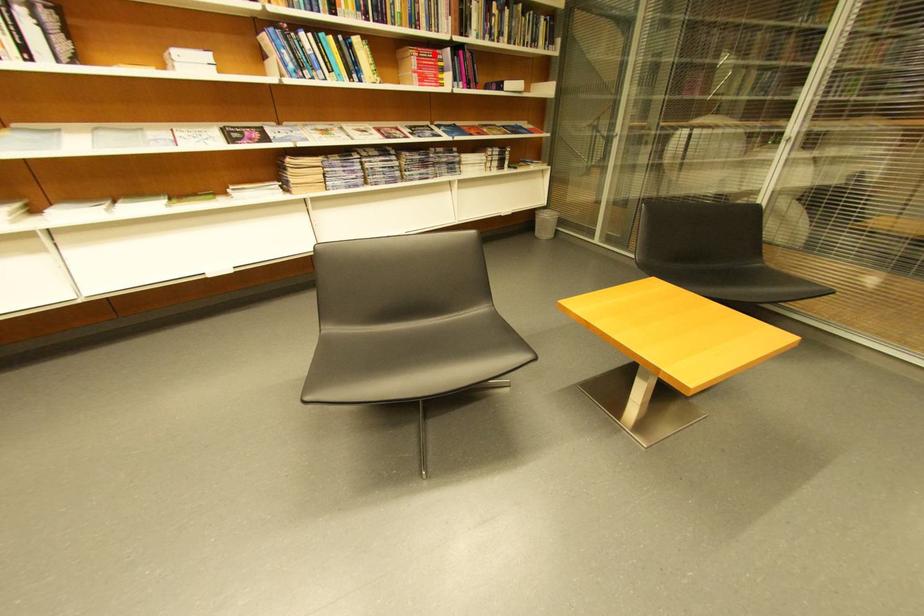
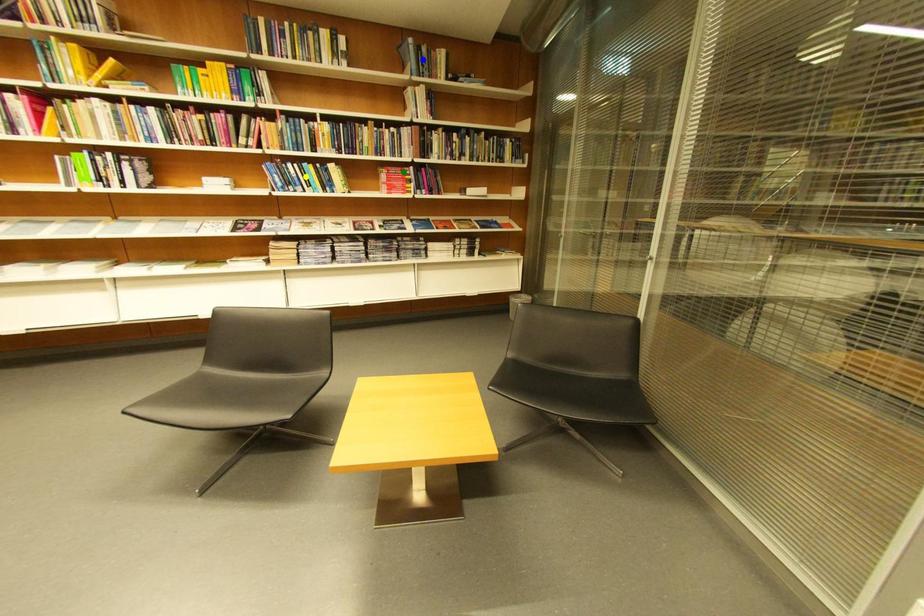
Question: I am providing you with two images of the same scene from different viewpoints. A red point is marked on the first image. You are given multiple points on the second image. Which mark in image 2 goes with the point in image 1?

Choices:
 (A) yellow point
 (B) green point
 (C) blue point

Answer: (B)